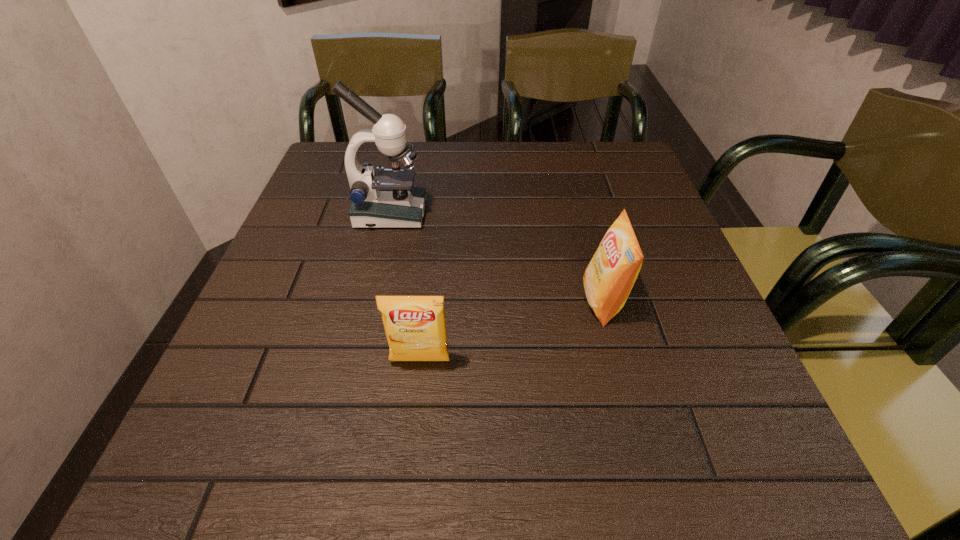
Identify which object is the second nearest to the farthest object. Please provide its 2D coordinates. Your answer should be formatted as a tuple, i.e. [(x, y)], where the tuple contains the x and y coordinates of a point satisfying the conditions above.

[(609, 277)]

Locate an element on the screen. the closest object to the nearest object is located at coordinates (609, 277).

Where is `vacant space that satisfies the following two spatial constraints: 1. on the front-facing side of the rightmost object; 2. on the front of the nearer crisp (potato chip) with the logo`? The width and height of the screenshot is (960, 540). vacant space that satisfies the following two spatial constraints: 1. on the front-facing side of the rightmost object; 2. on the front of the nearer crisp (potato chip) with the logo is located at coordinates (x=618, y=361).

Locate an element on the screen. Image resolution: width=960 pixels, height=540 pixels. blank area in the image that satisfies the following two spatial constraints: 1. on the front-facing side of the farther crisp (potato chip); 2. on the front of the left crisp (potato chip) with the logo is located at coordinates (618, 361).

Image resolution: width=960 pixels, height=540 pixels. I want to click on vacant region that satisfies the following two spatial constraints: 1. on the front-facing side of the second nearest object; 2. on the front of the nearer crisp (potato chip) with the logo, so click(x=618, y=361).

Locate an element on the screen. Image resolution: width=960 pixels, height=540 pixels. vacant space that satisfies the following two spatial constraints: 1. on the front-facing side of the right crisp (potato chip); 2. on the front of the nearest object with the logo is located at coordinates (618, 361).